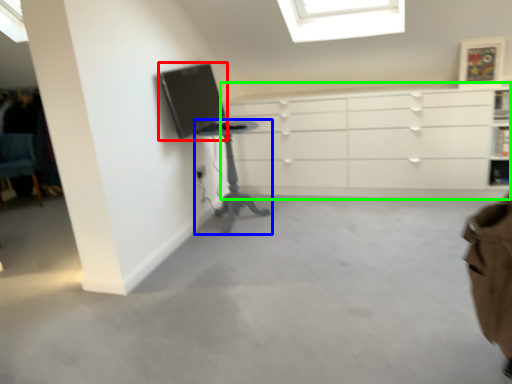
Question: Which object is positioned closest to computer monitor (highlighted by a red box)? Select from table (highlighted by a blue box) and chest of drawers (highlighted by a green box).

Choices:
 (A) table
 (B) chest of drawers

Answer: (A)